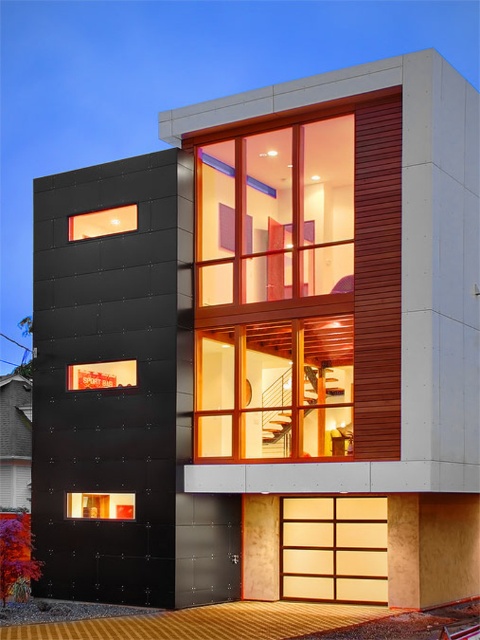
Is matte glass window at center wider than matte black window at lower left?

Yes.

Who is positioned more to the left, matte glass window at center or matte black window at lower left?

matte black window at lower left is more to the left.

Is point (277, 208) positioned behind point (73, 513)?

No, (277, 208) is in front of (73, 513).

This screenshot has height=640, width=480. Find the location of `matte glass window at center`. matte glass window at center is located at coordinates (276, 214).

This screenshot has width=480, height=640. I want to click on light beige wood garage door at lower center, so click(334, 548).

Who is more forward, (365, 579) or (106, 225)?

Point (365, 579) is more forward.

Is point (358, 579) positioned in front of point (126, 208)?

Yes, it is.

What are the coordinates of `light beige wood garage door at lower center` in the screenshot? It's located at (334, 548).